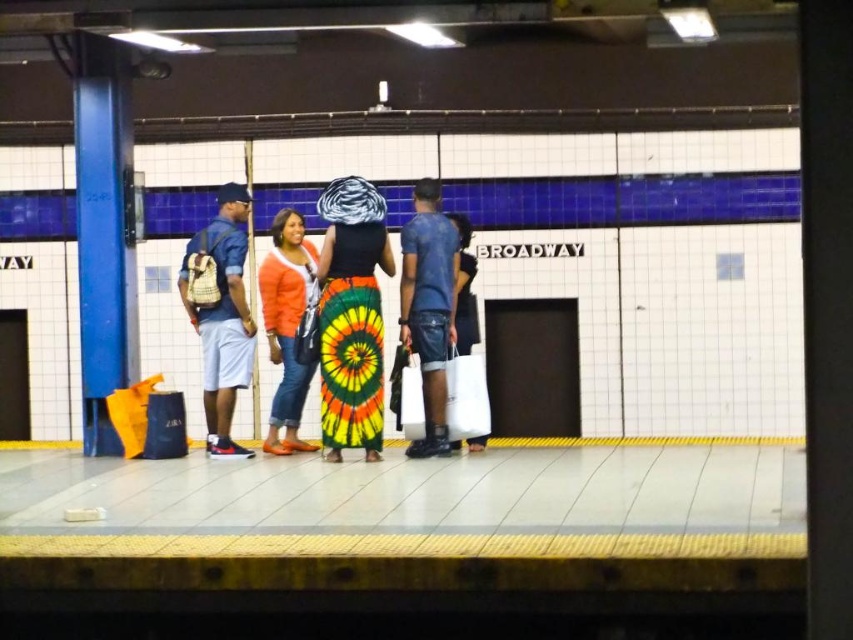
Question: Considering the real-world distances, which object is closest to the denim shorts at center?

Choices:
 (A) orange cotton sweater at center
 (B) tie-dye fabric skirt at center
 (C) white matte bag at center

Answer: (C)

Question: Does denim shorts at center appear on the right side of white matte bag at center?

Choices:
 (A) no
 (B) yes

Answer: (A)

Question: Does denim shorts at left appear over orange cotton sweater at center?

Choices:
 (A) yes
 (B) no

Answer: (A)

Question: Which object appears closest to the camera in this image?

Choices:
 (A) denim shorts at left
 (B) denim shorts at center
 (C) tie-dye fabric skirt at center
 (D) white matte bag at center

Answer: (C)

Question: Estimate the real-world distances between objects in this image. Which object is closer to the denim shorts at center?

Choices:
 (A) white matte bag at center
 (B) orange cotton sweater at center

Answer: (A)

Question: In this image, where is denim shorts at left located relative to orange cotton sweater at center?

Choices:
 (A) right
 (B) left

Answer: (B)